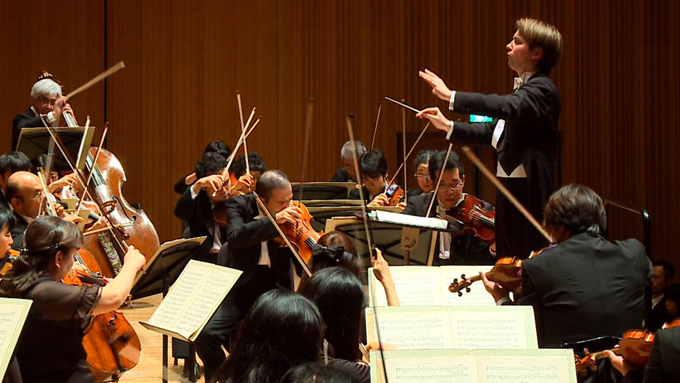
The width and height of the screenshot is (680, 383). I want to click on music sheets, so click(x=17, y=315), click(x=180, y=296), click(x=426, y=352), click(x=426, y=324), click(x=424, y=285), click(x=408, y=219), click(x=165, y=241), click(x=338, y=203), click(x=345, y=187), click(x=90, y=133).